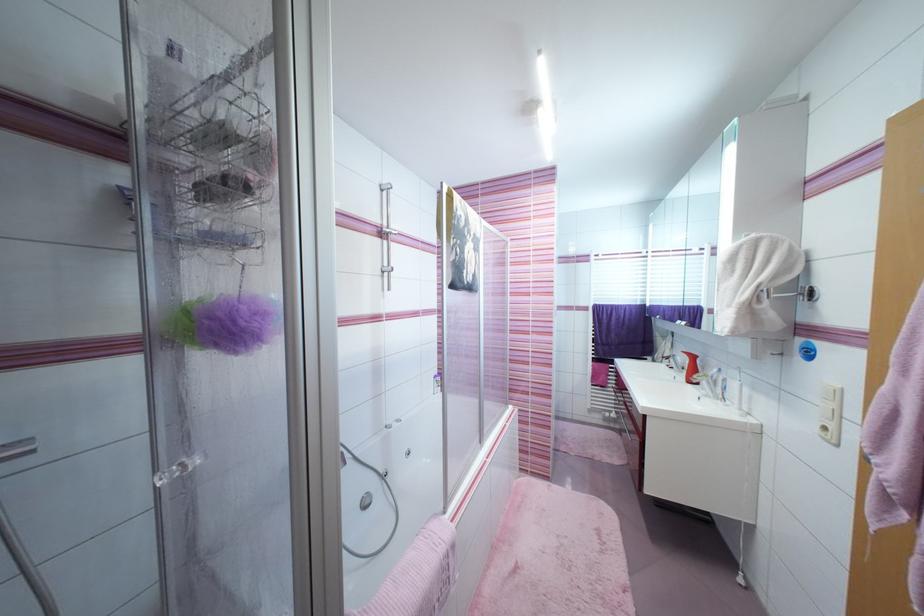
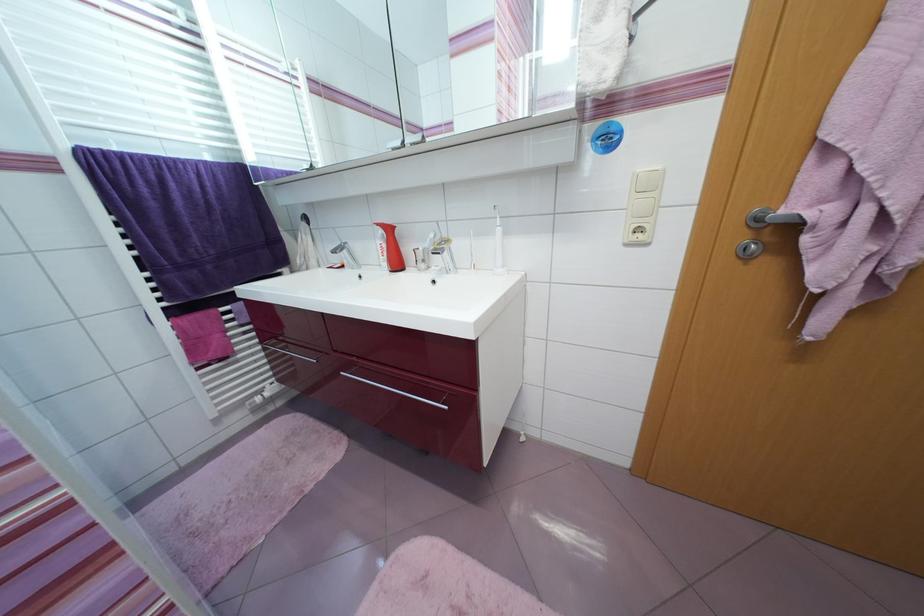
Where in the second image is the point corresponding to (699,359) from the first image?

(394, 231)